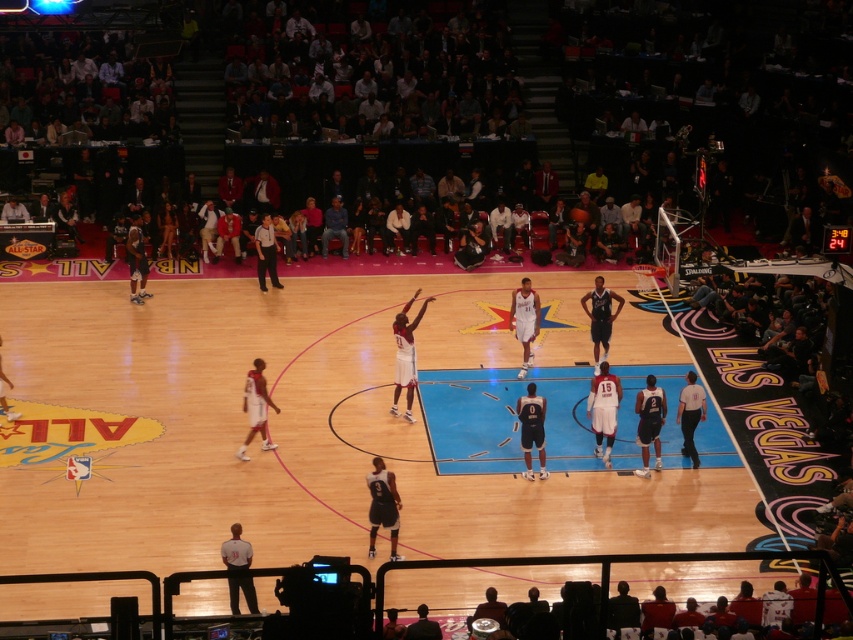
Is shiny red jersey at left below black matte basketball at center?

No, shiny red jersey at left is not below black matte basketball at center.

From the picture: Can you confirm if shiny red jersey at left is taller than black matte basketball at center?

Correct, shiny red jersey at left is much taller as black matte basketball at center.

Describe the element at coordinates (256, 406) in the screenshot. The image size is (853, 640). I see `shiny red jersey at left` at that location.

Identify the location of shiny red jersey at left. This screenshot has width=853, height=640. (256, 406).

Which is above, white glossy jersey at center or denim jeans at center?

denim jeans at center

Is white glossy jersey at center above denim jeans at center?

No.

Who is more forward, (392, 323) or (331, 212)?

Positioned in front is point (392, 323).

The height and width of the screenshot is (640, 853). What are the coordinates of `white glossy jersey at center` in the screenshot? It's located at (405, 355).

Does black matte basketball at center have a lesser width compared to shiny black basketball at center?

No, black matte basketball at center is not thinner than shiny black basketball at center.

Is black matte basketball at center to the right of shiny black basketball at center from the viewer's perspective?

No, black matte basketball at center is not to the right of shiny black basketball at center.

Is point (526, 408) positioned before point (579, 216)?

Yes, it is in front of point (579, 216).

Find the location of a particular element. The width and height of the screenshot is (853, 640). black matte basketball at center is located at coordinates (532, 429).